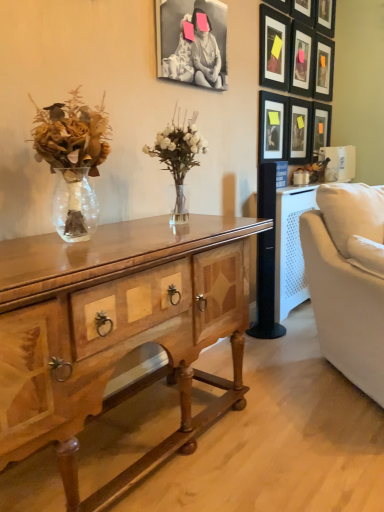
Question: Is matte black picture frame at upper right, which ranks as the ninth picture frame in left-to-right order, to the left or to the right of matte black picture frame at upper right, the seventh picture frame in the right-to-left sequence, in the image?

Choices:
 (A) left
 (B) right

Answer: (B)

Question: In terms of height, does matte black picture frame at upper right, the first picture frame viewed from the right, look taller or shorter compared to matte black picture frame at upper right, the seventh picture frame in the right-to-left sequence?

Choices:
 (A) short
 (B) tall

Answer: (A)

Question: Estimate the real-world distances between objects in this image. Which object is farther from the wooden desk at center?

Choices:
 (A) matte black picture frame at upper right, which ranks as the ninth picture frame in left-to-right order
 (B) wooden picture frame at upper right, which ranks as the 5th picture frame in right-to-left order
 (C) matte black picture frame at upper right, which appears as the sixth picture frame when viewed from the left
 (D) matte black picture frame at upper right, which appears as the 8th picture frame when viewed from the left
 (E) wooden picture frame at upper right, which ranks as the seventh picture frame in left-to-right order

Answer: (E)

Question: Based on their relative distances, which object is nearer to the matte black picture frame at upper right, acting as the 2th picture frame starting from the left?

Choices:
 (A) matte black picture frame at upper right, which appears as the sixth picture frame when viewed from the left
 (B) wooden picture frame at upper right, which ranks as the 5th picture frame in right-to-left order
 (C) matte black picture frame at upper right, which ranks as the ninth picture frame in left-to-right order
 (D) black matte picture frame at upper center, arranged as the 1th picture frame when viewed from the left
 (E) matte black picture frame at upper right, the third picture frame viewed from the left

Answer: (B)